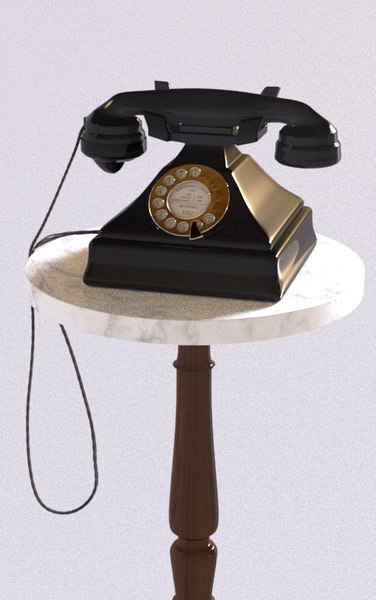
You are a GUI agent. You are given a task and a screenshot of the screen. Output one action in this format:
    pyautogui.click(x=<x>, y=<y>)
    Task: Click on the vintage rotary phone
    The width and height of the screenshot is (376, 600).
    Given the screenshot: What is the action you would take?
    pyautogui.click(x=192, y=203)